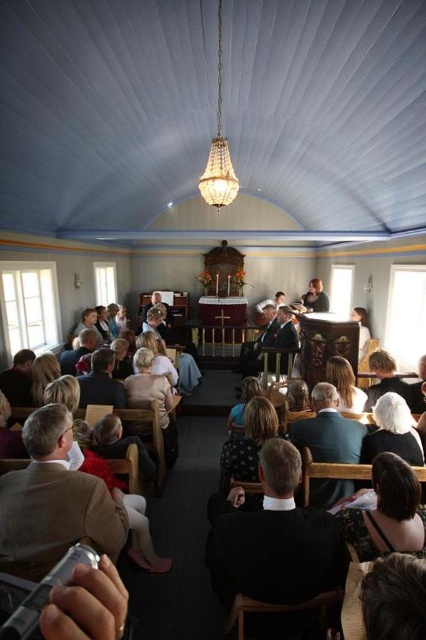
Question: Can you confirm if dark brown leather jacket at lower left is smaller than matte black jacket at lower left?

Choices:
 (A) yes
 (B) no

Answer: (B)

Question: Can you confirm if dark brown leather chair at center is positioned below matte black jacket at upper center?

Choices:
 (A) no
 (B) yes

Answer: (B)

Question: Which object is closer to the camera taking this photo?

Choices:
 (A) black suit at center
 (B) light brown hair at center
 (C) dark brown leather jacket at lower left

Answer: (A)

Question: Is the position of white hair at lower right more distant than that of matte black jacket at lower left?

Choices:
 (A) yes
 (B) no

Answer: (B)

Question: Which point is farther from the camera taking this photo?

Choices:
 (A) (397, 403)
 (B) (92, 321)
 (C) (412, 392)
 (D) (71, 364)

Answer: (B)

Question: Estimate the real-world distances between objects in this image. Which object is farther from the dark green suit at center?

Choices:
 (A) blonde hair at center
 (B) black suit at center
 (C) matte black jacket at lower left

Answer: (C)